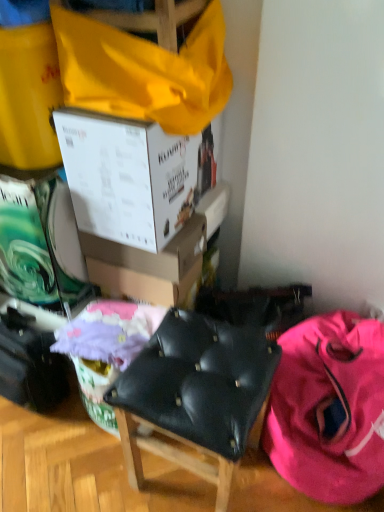
Question: Is pink fabric backpack at lower right completely or partially inside pastel pink fabric at center?

Choices:
 (A) yes
 (B) no

Answer: (B)

Question: Is pastel pink fabric at center positioned far away from pink fabric backpack at lower right?

Choices:
 (A) yes
 (B) no

Answer: (B)

Question: Does pastel pink fabric at center have a lesser height compared to pink fabric backpack at lower right?

Choices:
 (A) yes
 (B) no

Answer: (A)

Question: Considering the relative positions of pastel pink fabric at center and pink fabric backpack at lower right in the image provided, is pastel pink fabric at center to the left of pink fabric backpack at lower right from the viewer's perspective?

Choices:
 (A) yes
 (B) no

Answer: (A)

Question: Is pastel pink fabric at center to the right of pink fabric backpack at lower right from the viewer's perspective?

Choices:
 (A) no
 (B) yes

Answer: (A)

Question: Considering their positions, is white cardboard box at upper center, the 1th box positioned from the bottom, located in front of or behind white cardboard box at upper center, which ranks as the second box in bottom-to-top order?

Choices:
 (A) behind
 (B) front

Answer: (A)

Question: Looking at the image, does white cardboard box at upper center, the 1th box positioned from the bottom, seem bigger or smaller compared to white cardboard box at upper center, which ranks as the second box in bottom-to-top order?

Choices:
 (A) big
 (B) small

Answer: (B)

Question: Is white cardboard box at upper center, arranged as the second box when viewed from the top, spatially inside white cardboard box at upper center, positioned as the 1th box in top-to-bottom order, or outside of it?

Choices:
 (A) outside
 (B) inside

Answer: (A)

Question: Is white cardboard box at upper center, the 1th box positioned from the bottom, to the left or to the right of white cardboard box at upper center, which ranks as the second box in bottom-to-top order, in the image?

Choices:
 (A) left
 (B) right

Answer: (B)

Question: From their relative heights in the image, would you say black leather chair at center is taller or shorter than pastel pink fabric at center?

Choices:
 (A) short
 (B) tall

Answer: (B)

Question: Relative to pastel pink fabric at center, is black leather chair at center in front or behind?

Choices:
 (A) front
 (B) behind

Answer: (A)

Question: Is black leather chair at center inside the boundaries of pastel pink fabric at center, or outside?

Choices:
 (A) inside
 (B) outside

Answer: (B)

Question: From a real-world perspective, relative to pastel pink fabric at center, is black leather chair at center vertically above or below?

Choices:
 (A) above
 (B) below

Answer: (B)

Question: Is pink fabric backpack at lower right to the left or to the right of white cardboard box at upper center, arranged as the second box when viewed from the top, in the image?

Choices:
 (A) right
 (B) left

Answer: (A)

Question: Considering the positions of pink fabric backpack at lower right and white cardboard box at upper center, arranged as the second box when viewed from the top, in the image, is pink fabric backpack at lower right wider or thinner than white cardboard box at upper center, arranged as the second box when viewed from the top,?

Choices:
 (A) wide
 (B) thin

Answer: (A)